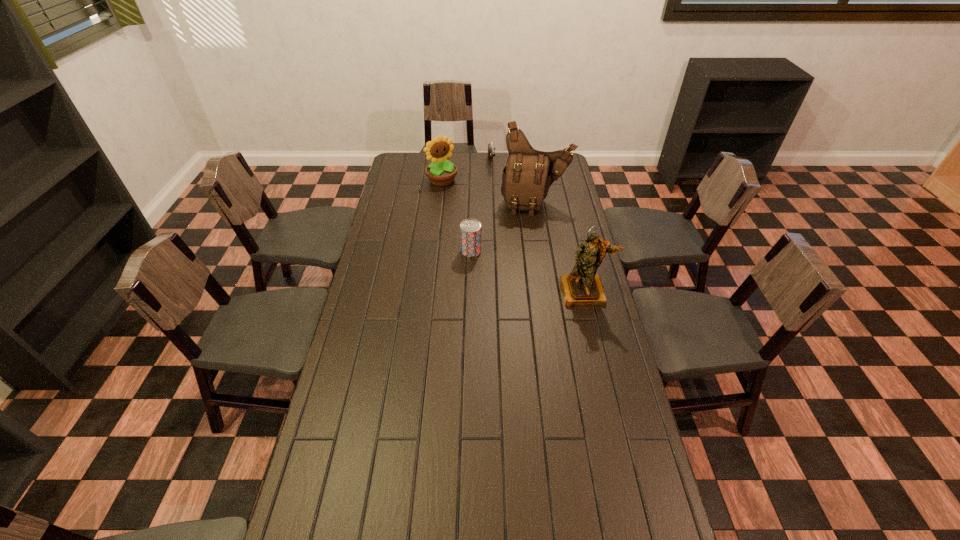
What are the coordinates of `the fourth farthest object` in the screenshot? It's located at (470, 229).

I want to click on the fourth object from right to left, so click(x=470, y=229).

Locate an element on the screen. the nearest object is located at coordinates (583, 286).

At what (x,y) coordinates should I click in order to perform the action: click on figurine. Please return your answer as a coordinate pair (x, y). This screenshot has width=960, height=540. Looking at the image, I should click on (583, 286).

Where is `the third object from left to right`? The width and height of the screenshot is (960, 540). the third object from left to right is located at coordinates (491, 147).

I want to click on the third tallest object, so click(x=441, y=172).

The image size is (960, 540). Find the location of `the leftmost object`. the leftmost object is located at coordinates (441, 172).

You are a GUI agent. You are given a task and a screenshot of the screen. Output one action in this format:
    pyautogui.click(x=<x>, y=<y>)
    Task: Click on the shoulder bag
    
    Given the screenshot: What is the action you would take?
    pyautogui.click(x=528, y=174)

The image size is (960, 540). In order to click on the third nearest object in this screenshot , I will do `click(528, 174)`.

This screenshot has width=960, height=540. Identify the location of free region located on the front of the beer can. (470, 293).